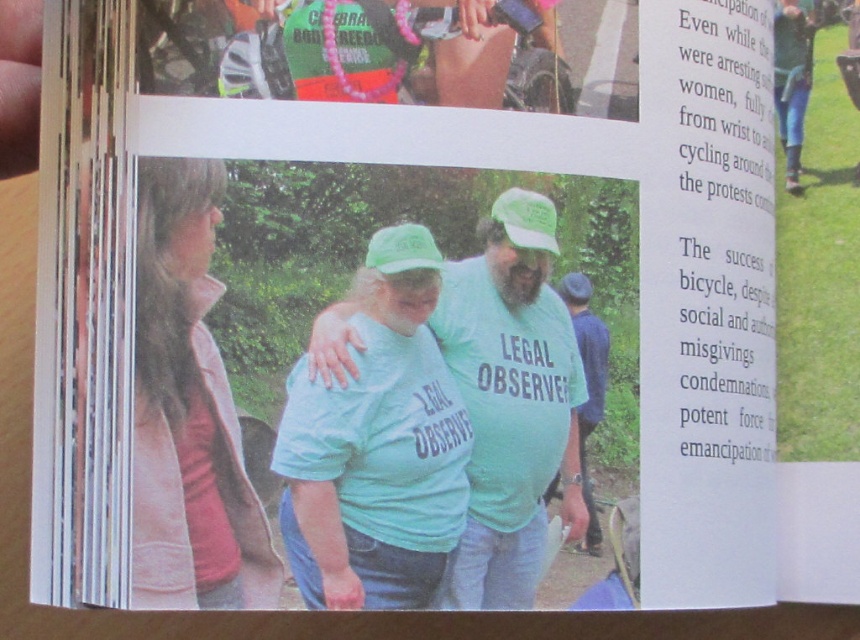
Between light blue t-shirt at center and pink fleece jacket at left, which one has more height?

With more height is pink fleece jacket at left.

Is point (339, 472) closer to camera compared to point (154, 170)?

Yes.

Is point (303, 420) positioned behind point (244, 492)?

Yes, point (303, 420) is behind point (244, 492).

The width and height of the screenshot is (860, 640). What are the coordinates of `light blue t-shirt at center` in the screenshot? It's located at (378, 445).

Is light blue fabric shirt at center above pink fleece jacket at left?

Actually, light blue fabric shirt at center is below pink fleece jacket at left.

This screenshot has height=640, width=860. I want to click on light blue fabric shirt at center, so click(511, 401).

Find the location of a particular element. This screenshot has height=640, width=860. light blue fabric shirt at center is located at coordinates (511, 401).

Is light blue t-shirt at center above light blue fabric shirt at center?

Actually, light blue t-shirt at center is below light blue fabric shirt at center.

Locate an element on the screen. light blue t-shirt at center is located at coordinates pos(378,445).

At what (x,y) coordinates should I click in order to perform the action: click on light blue t-shirt at center. Please return your answer as a coordinate pair (x, y). This screenshot has height=640, width=860. Looking at the image, I should click on (378, 445).